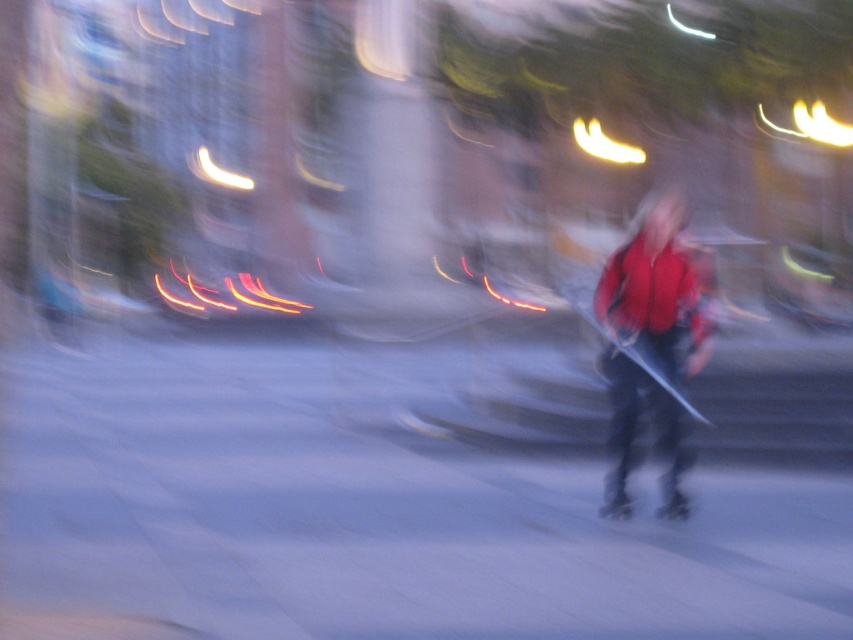
Which is in front, point (323, 467) or point (666, 504)?

Point (666, 504) is more forward.

Between gray asphalt at center and shiny black roller skate at center, which one has more height?

gray asphalt at center is taller.

Locate an element on the screen. gray asphalt at center is located at coordinates (366, 520).

Is gray asphalt at center bigger than metallic silver skateboard at center?

Correct, gray asphalt at center is larger in size than metallic silver skateboard at center.

Consider the image. Is gray asphalt at center positioned behind metallic silver skateboard at center?

No, it is not.

The width and height of the screenshot is (853, 640). What are the coordinates of `gray asphalt at center` in the screenshot? It's located at coord(366,520).

Identify the location of gray asphalt at center. Image resolution: width=853 pixels, height=640 pixels. (366, 520).

Who is taller, red matte jacket at center or metallic silver skateboard at center?

red matte jacket at center

Who is positioned more to the right, red matte jacket at center or metallic silver skateboard at center?

red matte jacket at center is more to the right.

Where is `red matte jacket at center`? red matte jacket at center is located at coordinates (654, 285).

What are the coordinates of `red matte jacket at center` in the screenshot? It's located at (654, 285).